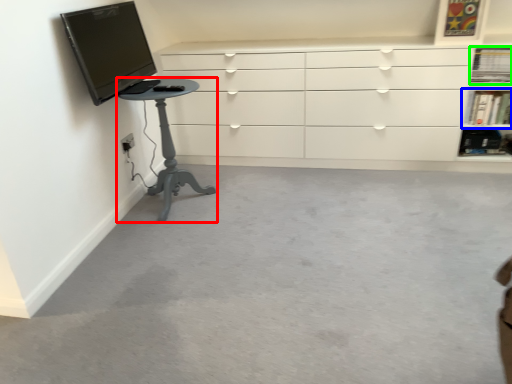
Question: Based on their relative distances, which object is nearer to furniture (highlighted by a red box)? Choose from shelf (highlighted by a blue box) and shelf (highlighted by a green box).

Choices:
 (A) shelf
 (B) shelf

Answer: (A)